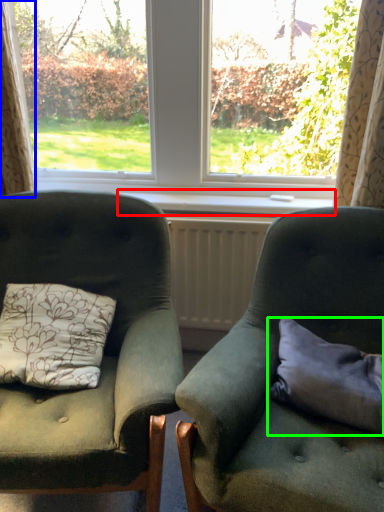
Question: Which object is positioned closest to window sill (highlighted by a red box)? Select from curtain (highlighted by a blue box) and pillow (highlighted by a green box).

Choices:
 (A) curtain
 (B) pillow

Answer: (A)